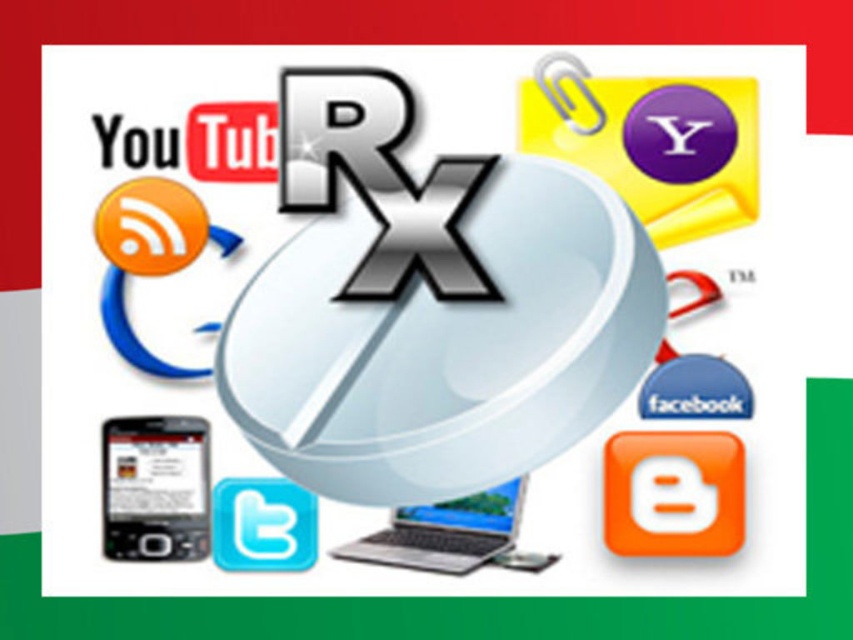
Question: Can you confirm if black glossy phone at bottom left is wider than satin silver laptop at center?

Choices:
 (A) yes
 (B) no

Answer: (B)

Question: Which of the following is the farthest from the observer?

Choices:
 (A) satin silver laptop at center
 (B) black glossy phone at bottom left

Answer: (A)

Question: Can you confirm if black glossy phone at bottom left is positioned below satin silver laptop at center?

Choices:
 (A) yes
 (B) no

Answer: (B)

Question: Which point appears closest to the camera in this image?

Choices:
 (A) (149, 429)
 (B) (419, 529)

Answer: (A)

Question: Is black glossy phone at bottom left closer to camera compared to satin silver laptop at center?

Choices:
 (A) yes
 (B) no

Answer: (A)